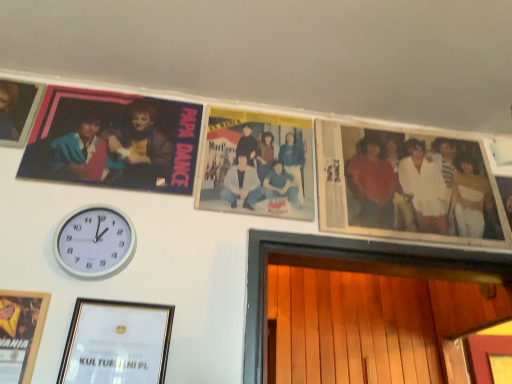
Question: Is white cotton shirt at right aimed at white plastic wall clock at lower left?

Choices:
 (A) yes
 (B) no

Answer: (B)

Question: Does white cotton shirt at right have a smaller size compared to white plastic wall clock at lower left?

Choices:
 (A) no
 (B) yes

Answer: (A)

Question: Is white plastic wall clock at lower left located within white cotton shirt at right?

Choices:
 (A) no
 (B) yes

Answer: (A)

Question: Is white cotton shirt at right looking in the opposite direction of white plastic wall clock at lower left?

Choices:
 (A) yes
 (B) no

Answer: (B)

Question: From the image's perspective, would you say white cotton shirt at right is shown under white plastic wall clock at lower left?

Choices:
 (A) yes
 (B) no

Answer: (B)

Question: From a real-world perspective, is white cotton shirt at right positioned under white plastic wall clock at lower left based on gravity?

Choices:
 (A) yes
 (B) no

Answer: (B)

Question: Considering the relative positions of white plastic wall clock at lower left and matte plastic photo frame at upper left, which is counted as the 3th picture frame, starting from the bottom, in the image provided, is white plastic wall clock at lower left to the left of matte plastic photo frame at upper left, which is counted as the 3th picture frame, starting from the bottom, from the viewer's perspective?

Choices:
 (A) yes
 (B) no

Answer: (A)

Question: Can you confirm if white plastic wall clock at lower left is shorter than matte plastic photo frame at upper left, which is counted as the 3th picture frame, starting from the bottom?

Choices:
 (A) no
 (B) yes

Answer: (B)

Question: Does white plastic wall clock at lower left touch matte plastic photo frame at upper left, which is counted as the 3th picture frame, starting from the bottom?

Choices:
 (A) no
 (B) yes

Answer: (A)

Question: Does white plastic wall clock at lower left appear on the right side of matte plastic photo frame at upper left, which is counted as the 3th picture frame, starting from the bottom?

Choices:
 (A) yes
 (B) no

Answer: (B)

Question: Is white plastic wall clock at lower left closer to the viewer compared to matte plastic photo frame at upper left, which is counted as the 3th picture frame, starting from the bottom?

Choices:
 (A) no
 (B) yes

Answer: (B)

Question: Is white plastic wall clock at lower left taller than matte plastic photo frame at upper left, which is counted as the 3th picture frame, starting from the bottom?

Choices:
 (A) no
 (B) yes

Answer: (A)

Question: Is matte black photo frame at upper left, positioned as the first picture frame in top-to-bottom order, surrounded by matte plastic photo frame at upper left, the 2th picture frame when ordered from top to bottom?

Choices:
 (A) yes
 (B) no

Answer: (B)